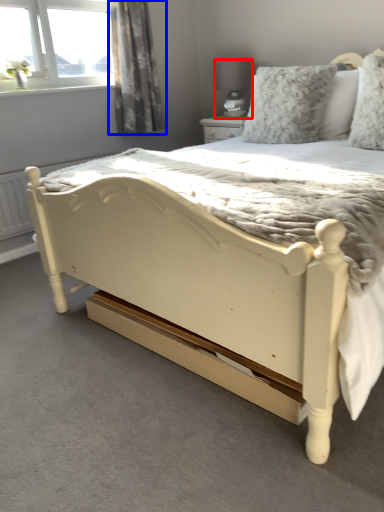
Question: Which of the following is the farthest to the observer, lamp (highlighted by a red box) or curtain (highlighted by a blue box)?

Choices:
 (A) lamp
 (B) curtain

Answer: (A)